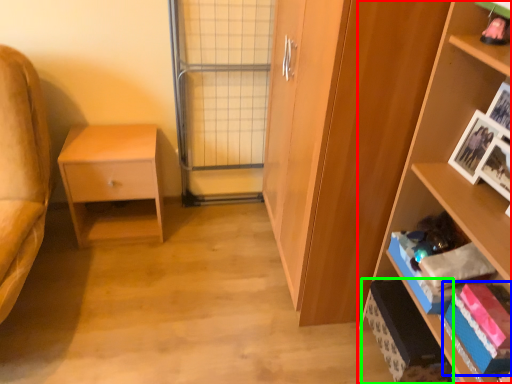
Question: Considering the real-world distances, which object is closest to shelf (highlighted by a red box)? book (highlighted by a blue box) or cabinet (highlighted by a green box).

Choices:
 (A) book
 (B) cabinet

Answer: (A)